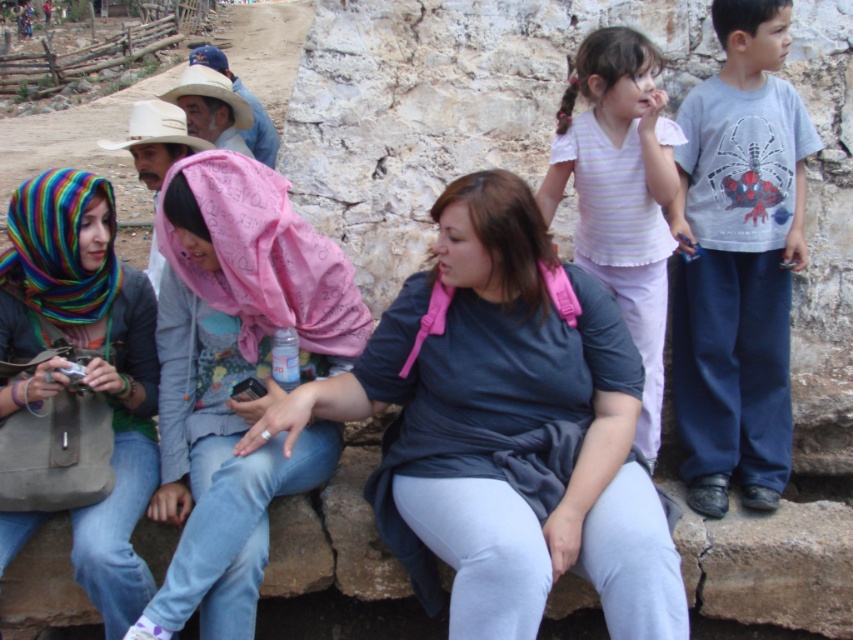
Question: Which object is the farthest from the gray cotton t-shirt at right?

Choices:
 (A) multicolored knitted scarf at left
 (B) matte gray shirt at center
 (C) striped cotton shirt at upper right

Answer: (A)

Question: Does matte gray shirt at center have a lesser width compared to multicolored knitted scarf at left?

Choices:
 (A) yes
 (B) no

Answer: (B)

Question: Is gray cotton t-shirt at right in front of multicolored knitted scarf at left?

Choices:
 (A) no
 (B) yes

Answer: (A)

Question: Which object is the closest to the striped cotton shirt at upper right?

Choices:
 (A) pink fabric headscarf at center
 (B) multicolored knitted scarf at left

Answer: (A)

Question: Can you confirm if matte gray shirt at center is bigger than pink fabric headscarf at center?

Choices:
 (A) no
 (B) yes

Answer: (B)

Question: Which of the following is the closest to the observer?

Choices:
 (A) (341, 413)
 (B) (328, 269)

Answer: (A)